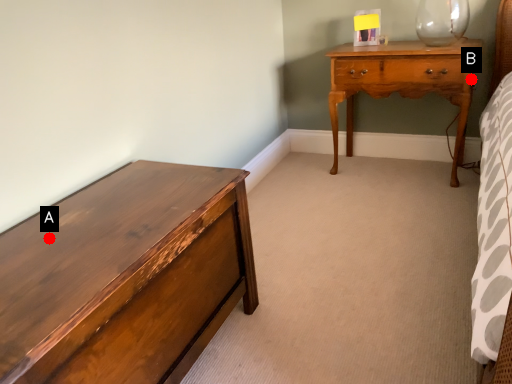
Question: Two points are circled on the image, labeled by A and B beside each circle. Which point is closer to the camera?

Choices:
 (A) A is closer
 (B) B is closer

Answer: (A)